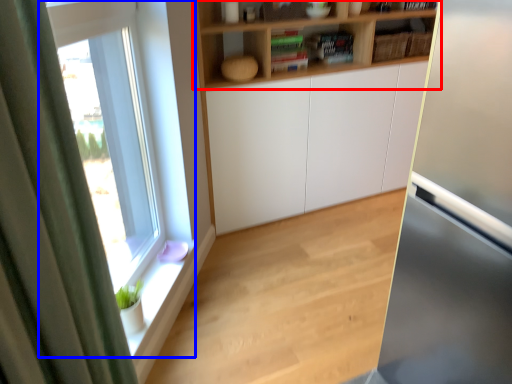
Question: Which of the following is the farthest to the observer, shelf (highlighted by a red box) or window (highlighted by a blue box)?

Choices:
 (A) shelf
 (B) window

Answer: (A)